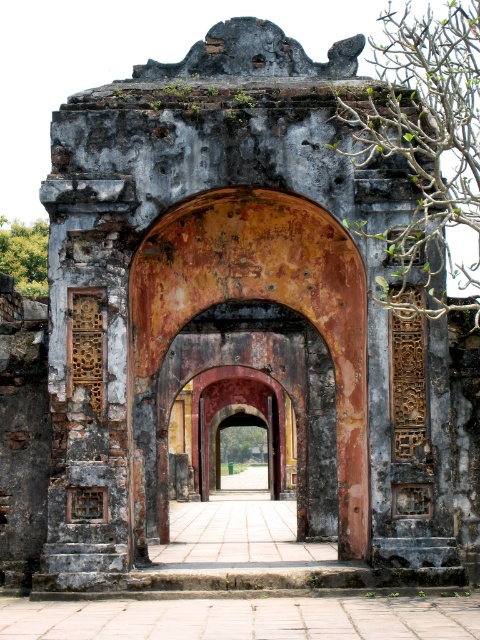
Question: Which object appears closest to the camera in this image?

Choices:
 (A) green leafy tree at upper left
 (B) smooth stone path at center
 (C) green leafy branches at upper right

Answer: (B)

Question: Can you confirm if green leafy tree at upper left is bigger than green leafy tree at center?

Choices:
 (A) yes
 (B) no

Answer: (A)

Question: Among these objects, which one is farthest from the camera?

Choices:
 (A) smooth stone path at center
 (B) green leafy tree at upper left

Answer: (B)

Question: Does green leafy branches at upper right lie behind smooth stone path at center?

Choices:
 (A) no
 (B) yes

Answer: (B)

Question: Which of the following is the farthest from the observer?

Choices:
 (A) (0, 220)
 (B) (294, 504)
 (C) (465, 209)

Answer: (A)

Question: Does green leafy branches at upper right have a smaller size compared to green leafy tree at upper left?

Choices:
 (A) yes
 (B) no

Answer: (B)